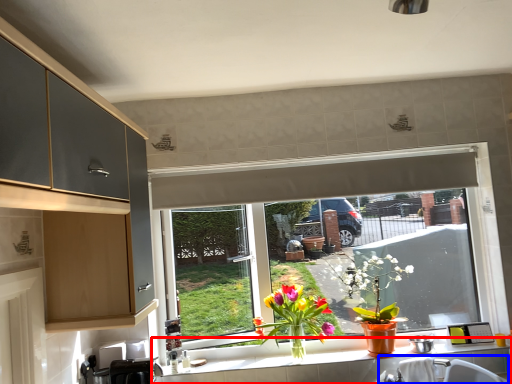
Question: Which of the following is the closest to the observer, countertop (highlighted by a red box) or sink (highlighted by a blue box)?

Choices:
 (A) countertop
 (B) sink

Answer: (B)